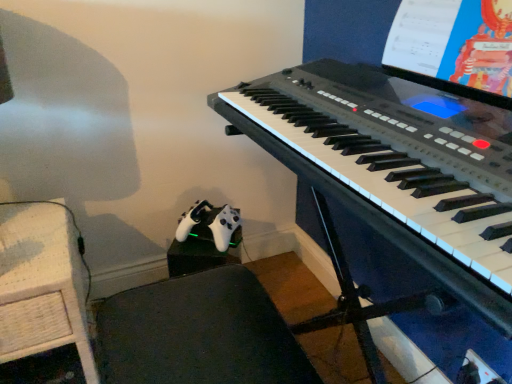
Question: From the image's perspective, does woven wood table at lower left appear lower than black plastic keyboard at center?

Choices:
 (A) no
 (B) yes

Answer: (B)

Question: Is there a large distance between woven wood table at lower left and black plastic keyboard at center?

Choices:
 (A) no
 (B) yes

Answer: (A)

Question: Is woven wood table at lower left smaller than black plastic keyboard at center?

Choices:
 (A) no
 (B) yes

Answer: (A)

Question: Is black plastic keyboard at center surrounded by woven wood table at lower left?

Choices:
 (A) yes
 (B) no

Answer: (B)

Question: Does woven wood table at lower left turn towards black plastic keyboard at center?

Choices:
 (A) yes
 (B) no

Answer: (B)

Question: Is point (424, 41) closer or farther from the camera than point (3, 284)?

Choices:
 (A) closer
 (B) farther

Answer: (B)

Question: Looking at their shapes, would you say white paper at upper right is wider or thinner than woven wood table at lower left?

Choices:
 (A) wide
 (B) thin

Answer: (B)

Question: From their relative heights in the image, would you say white paper at upper right is taller or shorter than woven wood table at lower left?

Choices:
 (A) tall
 (B) short

Answer: (B)

Question: In the image, is white paper at upper right positioned in front of or behind woven wood table at lower left?

Choices:
 (A) front
 (B) behind

Answer: (A)

Question: From their relative heights in the image, would you say woven wood table at lower left is taller or shorter than black plastic keyboard at center?

Choices:
 (A) short
 (B) tall

Answer: (B)

Question: Choose the correct answer: Is woven wood table at lower left inside black plastic keyboard at center or outside it?

Choices:
 (A) outside
 (B) inside

Answer: (A)

Question: From the image's perspective, is woven wood table at lower left positioned above or below black plastic keyboard at center?

Choices:
 (A) below
 (B) above

Answer: (A)

Question: Considering their positions, is woven wood table at lower left located in front of or behind black plastic keyboard at center?

Choices:
 (A) behind
 (B) front

Answer: (A)

Question: Is point coord(446,104) closer or farther from the camera than point coord(445,87)?

Choices:
 (A) closer
 (B) farther

Answer: (A)

Question: Considering the positions of black plastic keyboard at center and white paper at upper right in the image, is black plastic keyboard at center bigger or smaller than white paper at upper right?

Choices:
 (A) big
 (B) small

Answer: (A)